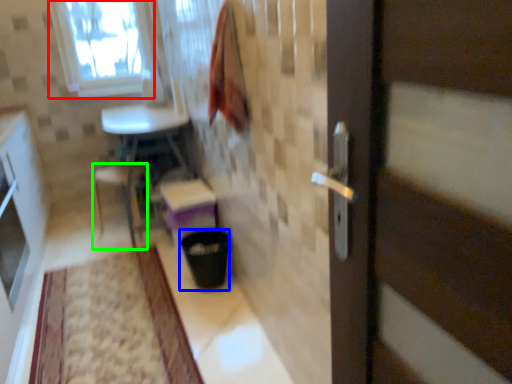
Question: Which object is positioned closest to window (highlighted by a red box)? Select from trash bin/can (highlighted by a blue box) and chair (highlighted by a green box).

Choices:
 (A) trash bin/can
 (B) chair

Answer: (B)